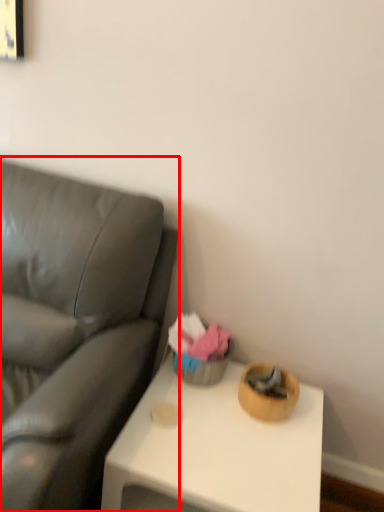
Question: From the image's perspective, what is the correct spatial positioning of studio couch (annotated by the red box) in reference to table?

Choices:
 (A) above
 (B) below

Answer: (A)